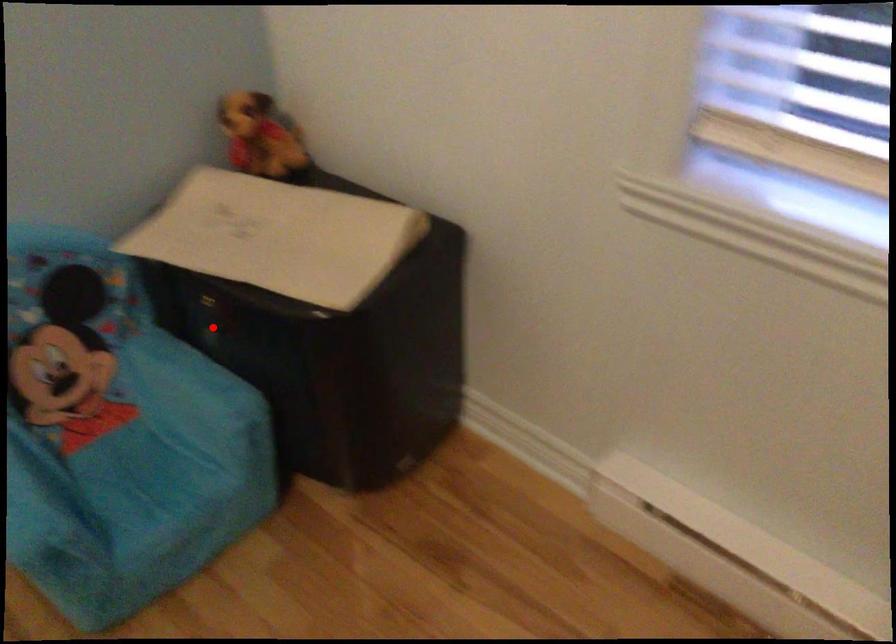
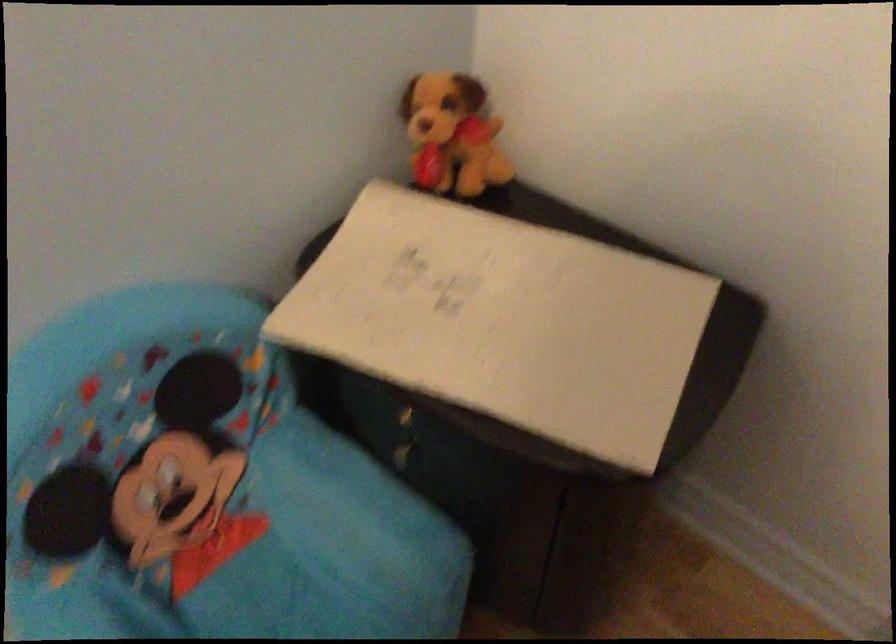
Locate, in the second image, the point that corresponds to the highlighted location in the first image.

(403, 438)